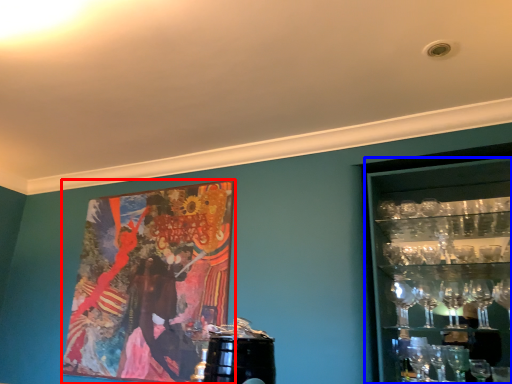
Question: Which of the following is the closest to the observer, picture frame (highlighted by a red box) or shelf (highlighted by a blue box)?

Choices:
 (A) picture frame
 (B) shelf

Answer: (B)